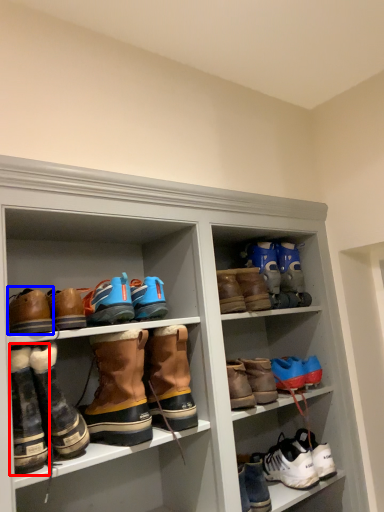
Question: Which point is further to the camera, footwear (highlighted by a red box) or footwear (highlighted by a blue box)?

Choices:
 (A) footwear
 (B) footwear

Answer: (B)